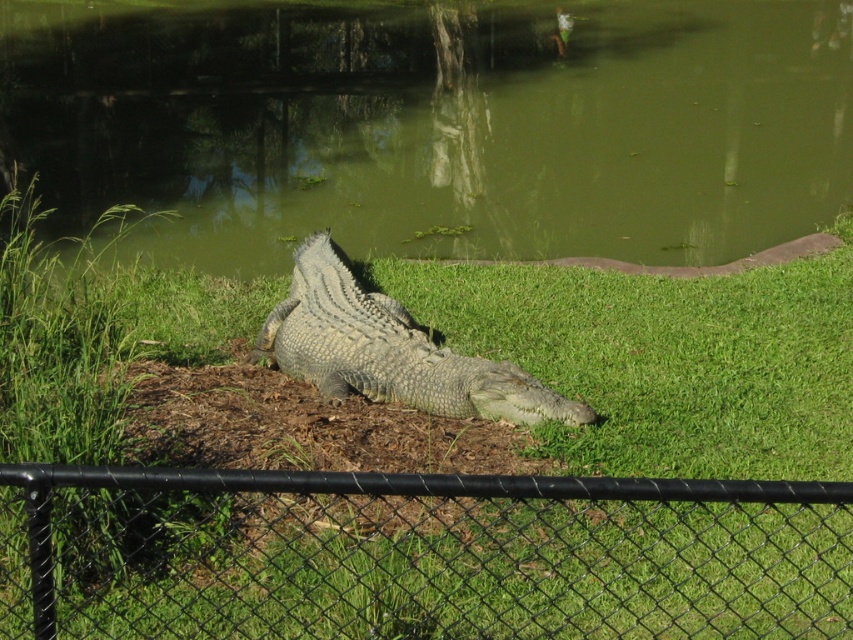
Question: Which of the following is the closest to the observer?

Choices:
 (A) (401, 321)
 (B) (585, 204)
 (C) (657, 593)

Answer: (C)

Question: Is green grassy at center closer to camera compared to black chain-link fence at center?

Choices:
 (A) no
 (B) yes

Answer: (A)

Question: Among these objects, which one is nearest to the camera?

Choices:
 (A) green grassy at center
 (B) green murky water at center
 (C) black chain-link fence at center

Answer: (C)

Question: Among these objects, which one is nearest to the camera?

Choices:
 (A) green grassy at center
 (B) green murky water at center
 (C) gray scaly crocodile at center
 (D) black chain-link fence at center

Answer: (D)

Question: Is black chain-link fence at center further to the viewer compared to gray scaly crocodile at center?

Choices:
 (A) no
 (B) yes

Answer: (A)

Question: Is green murky water at center bigger than black chain-link fence at center?

Choices:
 (A) yes
 (B) no

Answer: (A)